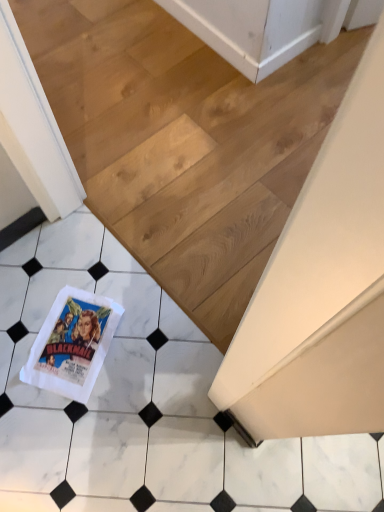
Locate an element on the screen. vacant area that is in front of white paper towel at lower left is located at coordinates (70, 423).